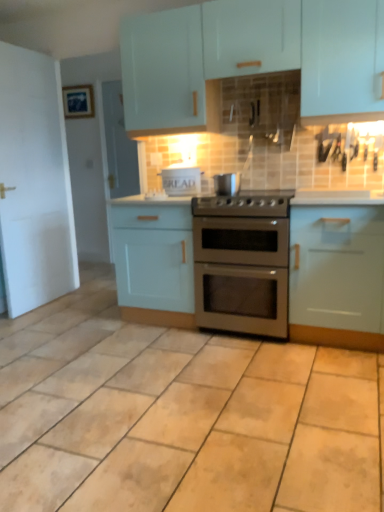
Question: Considering the relative positions of stainless steel gas stove at center and white cardboard bread box at center, which is counted as the 2th appliance, starting from the right, in the image provided, is stainless steel gas stove at center to the right of white cardboard bread box at center, which is counted as the 2th appliance, starting from the right, from the viewer's perspective?

Choices:
 (A) no
 (B) yes

Answer: (B)

Question: Does stainless steel gas stove at center contain white cardboard bread box at center, which ranks as the first appliance in back-to-front order?

Choices:
 (A) no
 (B) yes

Answer: (A)

Question: Is stainless steel gas stove at center shorter than white cardboard bread box at center, which is counted as the 2th appliance, starting from the right?

Choices:
 (A) no
 (B) yes

Answer: (B)

Question: Can you confirm if stainless steel gas stove at center is thinner than white cardboard bread box at center, which is counted as the 2th appliance, starting from the right?

Choices:
 (A) yes
 (B) no

Answer: (B)

Question: Is stainless steel gas stove at center outside white cardboard bread box at center, which ranks as the first appliance in back-to-front order?

Choices:
 (A) no
 (B) yes

Answer: (B)

Question: Is stainless steel gas stove at center wider than white cardboard bread box at center, acting as the 2th appliance starting from the front?

Choices:
 (A) no
 (B) yes

Answer: (B)

Question: Is matte blue picture frame at upper left touching white glossy countertop at center?

Choices:
 (A) yes
 (B) no

Answer: (B)

Question: Is matte blue picture frame at upper left positioned behind white glossy countertop at center?

Choices:
 (A) yes
 (B) no

Answer: (A)

Question: Considering the relative sizes of matte blue picture frame at upper left and white glossy countertop at center in the image provided, is matte blue picture frame at upper left bigger than white glossy countertop at center?

Choices:
 (A) no
 (B) yes

Answer: (A)

Question: Considering the relative positions of matte blue picture frame at upper left and white glossy countertop at center in the image provided, is matte blue picture frame at upper left in front of white glossy countertop at center?

Choices:
 (A) yes
 (B) no

Answer: (B)

Question: From the image's perspective, is matte blue picture frame at upper left beneath white glossy countertop at center?

Choices:
 (A) yes
 (B) no

Answer: (B)

Question: Is white glossy countertop at center a part of matte blue picture frame at upper left?

Choices:
 (A) no
 (B) yes

Answer: (A)

Question: Considering the relative positions of satin silver pot at center, marked as the 1th appliance in a front-to-back arrangement, and matte white cabinets at upper center, placed as the third cabinetry when sorted from bottom to top, in the image provided, is satin silver pot at center, marked as the 1th appliance in a front-to-back arrangement, to the left of matte white cabinets at upper center, placed as the third cabinetry when sorted from bottom to top, from the viewer's perspective?

Choices:
 (A) yes
 (B) no

Answer: (A)